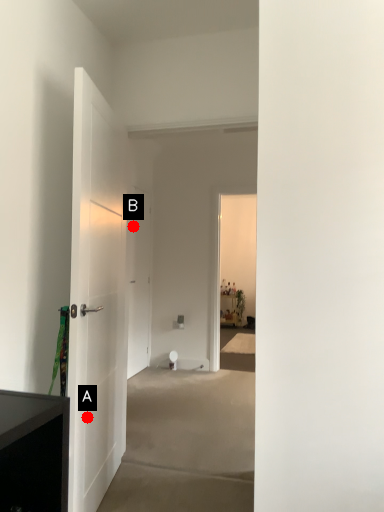
Question: Two points are circled on the image, labeled by A and B beside each circle. Which point is closer to the camera taking this photo?

Choices:
 (A) A is closer
 (B) B is closer

Answer: (A)